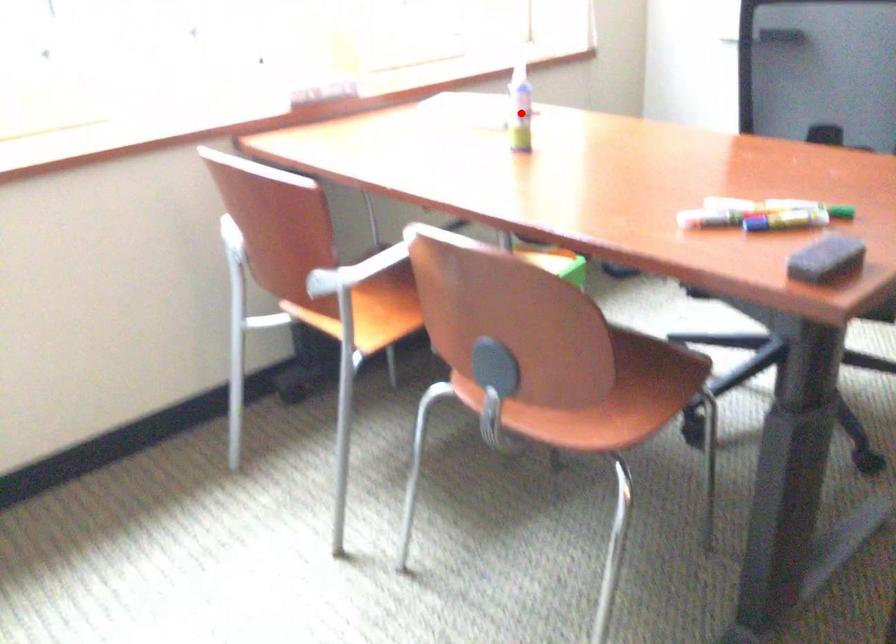
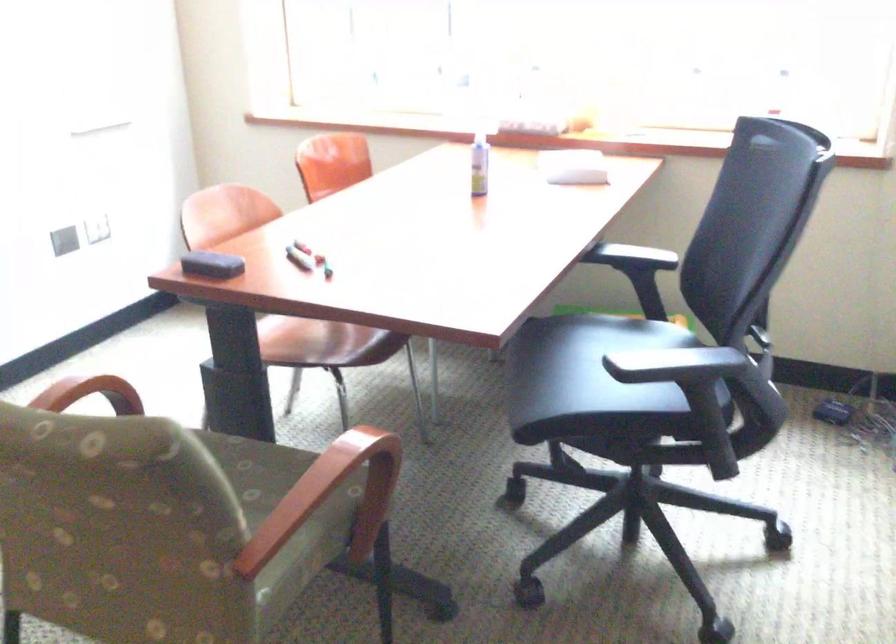
The point at the highlighted location is marked in the first image. Where is the corresponding point in the second image?

(478, 164)